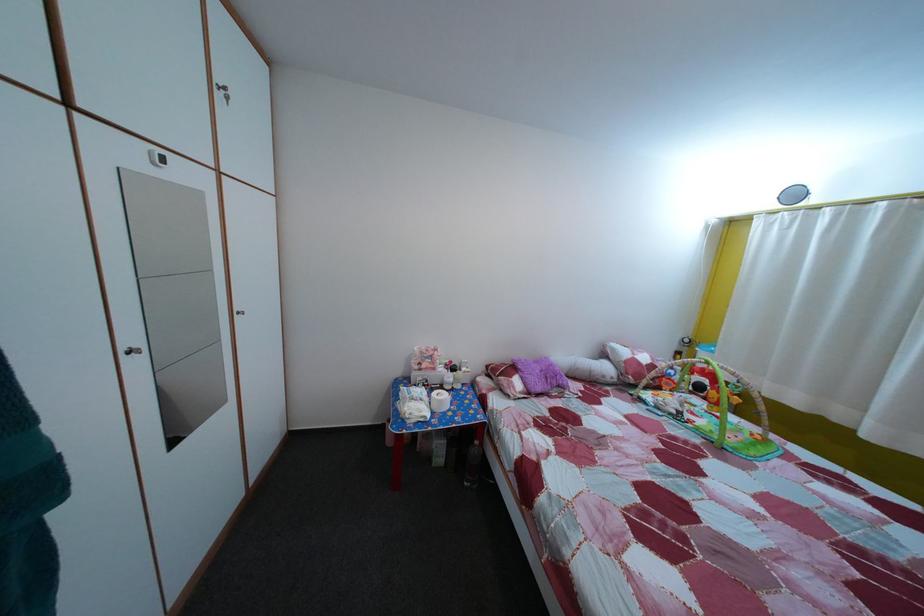
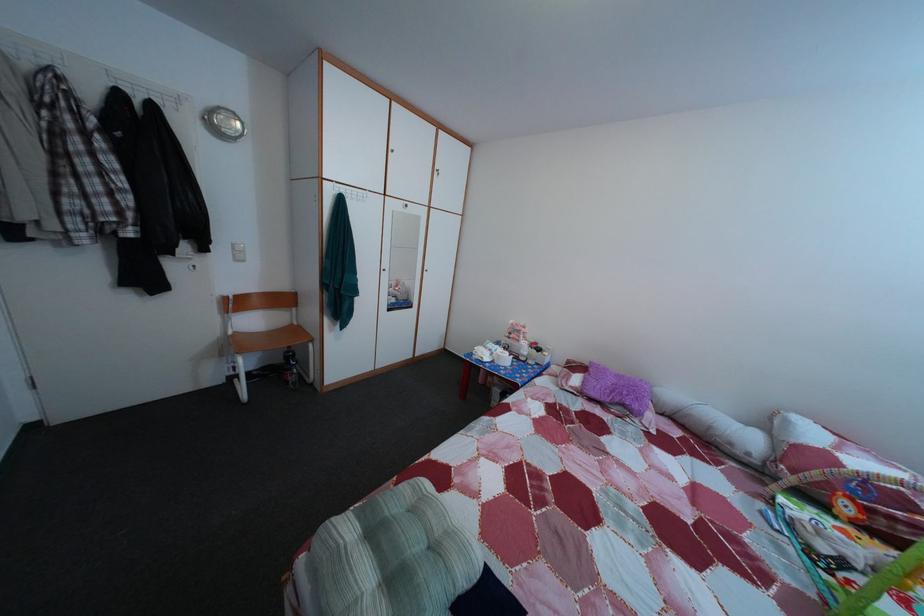
Find the pixel in the second image that matches (x=565, y=398) in the first image.

(628, 416)